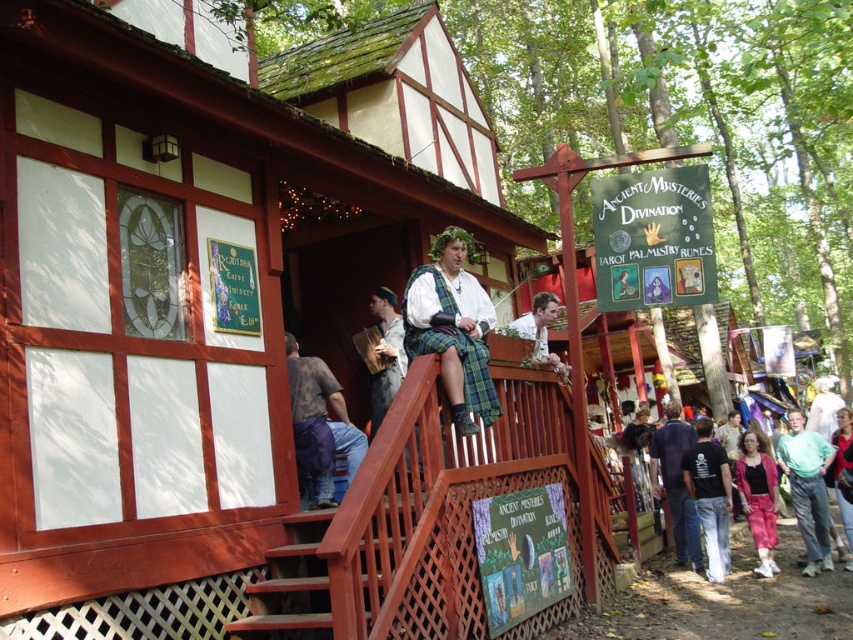
Question: Can you confirm if wooden lattice porch at center is wider than plaid fabric kilt at center?

Choices:
 (A) yes
 (B) no

Answer: (A)

Question: Which object is closer to the camera taking this photo?

Choices:
 (A) white cotton shirt at upper center
 (B) green cotton shirt at lower right
 (C) plaid fabric kilt at center
 (D) light brown wood bench at upper center

Answer: (C)

Question: Which is nearer to the wooden lattice porch at center?

Choices:
 (A) light brown wood bench at upper center
 (B) dark blue shirt at center

Answer: (A)

Question: Among these objects, which one is farthest from the camera?

Choices:
 (A) wooden lattice porch at center
 (B) light brown wood bench at upper center
 (C) brown cotton pants at lower center

Answer: (B)

Question: Is brown wooden stairs at lower center further to the viewer compared to matte green fabric at upper right?

Choices:
 (A) yes
 (B) no

Answer: (B)

Question: Is plaid fabric kilt at center thinner than wooden plaid kilt at center?

Choices:
 (A) yes
 (B) no

Answer: (B)